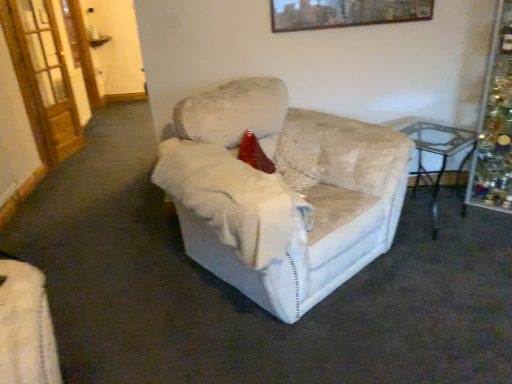
Question: Considering the relative sizes of velvet beige armchair at center and transparent glass table at right in the image provided, is velvet beige armchair at center taller than transparent glass table at right?

Choices:
 (A) yes
 (B) no

Answer: (A)

Question: Is velvet beige armchair at center not inside transparent glass table at right?

Choices:
 (A) no
 (B) yes

Answer: (B)

Question: From the image's perspective, is velvet beige armchair at center under transparent glass table at right?

Choices:
 (A) yes
 (B) no

Answer: (A)

Question: Considering the relative sizes of velvet beige armchair at center and transparent glass table at right in the image provided, is velvet beige armchair at center shorter than transparent glass table at right?

Choices:
 (A) yes
 (B) no

Answer: (B)

Question: Is the position of velvet beige armchair at center more distant than that of transparent glass table at right?

Choices:
 (A) yes
 (B) no

Answer: (B)

Question: Does point (420, 16) appear closer or farther from the camera than point (31, 34)?

Choices:
 (A) closer
 (B) farther

Answer: (A)

Question: Based on their positions, is wooden framed artwork at upper center located to the left or right of wooden door at left?

Choices:
 (A) right
 (B) left

Answer: (A)

Question: Is wooden framed artwork at upper center spatially inside wooden door at left, or outside of it?

Choices:
 (A) outside
 (B) inside

Answer: (A)

Question: In terms of size, does wooden framed artwork at upper center appear bigger or smaller than wooden door at left?

Choices:
 (A) big
 (B) small

Answer: (B)

Question: Is point (301, 24) closer or farther from the camera than point (306, 188)?

Choices:
 (A) closer
 (B) farther

Answer: (B)

Question: In the image, is wooden framed artwork at upper center positioned in front of or behind velvet red pillow at center?

Choices:
 (A) behind
 (B) front

Answer: (A)

Question: From a real-world perspective, is wooden framed artwork at upper center above or below velvet red pillow at center?

Choices:
 (A) below
 (B) above

Answer: (B)

Question: In terms of width, does wooden framed artwork at upper center look wider or thinner when compared to velvet red pillow at center?

Choices:
 (A) thin
 (B) wide

Answer: (A)

Question: Considering the positions of point (231, 254) and point (391, 119), is point (231, 254) closer or farther from the camera than point (391, 119)?

Choices:
 (A) farther
 (B) closer

Answer: (B)

Question: From their relative heights in the image, would you say velvet beige armchair at center is taller or shorter than transparent glass table at right?

Choices:
 (A) tall
 (B) short

Answer: (A)